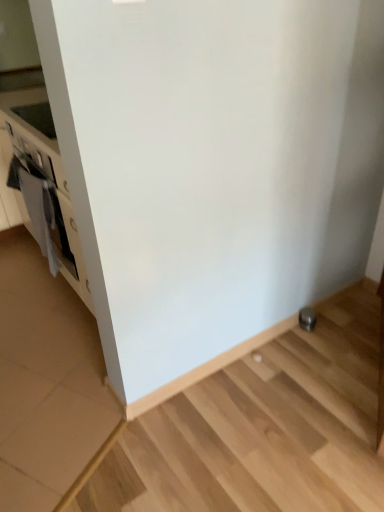
Question: From the image's perspective, relative to satin silver knob at lower right, is white matte oven at left above or below?

Choices:
 (A) above
 (B) below

Answer: (A)

Question: Would you say white matte oven at left is to the left or to the right of satin silver knob at lower right in the picture?

Choices:
 (A) left
 (B) right

Answer: (A)

Question: Is white matte oven at left bigger or smaller than satin silver knob at lower right?

Choices:
 (A) small
 (B) big

Answer: (B)

Question: In the image, is satin silver knob at lower right on the left side or the right side of white matte oven at left?

Choices:
 (A) right
 (B) left

Answer: (A)

Question: Considering the positions of point (299, 317) and point (16, 163), is point (299, 317) closer or farther from the camera than point (16, 163)?

Choices:
 (A) farther
 (B) closer

Answer: (A)

Question: Is satin silver knob at lower right in front of or behind white matte oven at left in the image?

Choices:
 (A) behind
 (B) front

Answer: (A)

Question: Looking at the image, does satin silver knob at lower right seem bigger or smaller compared to white matte oven at left?

Choices:
 (A) small
 (B) big

Answer: (A)